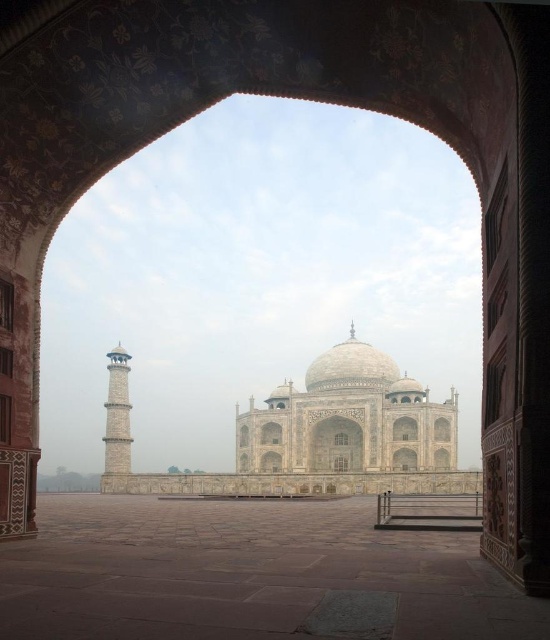
You are standing in the brown stone courtyard at center and want to take a photo of the stone minaret at left. Since the courtyard is lower, will you need to look up or down to frame the minaret properly?

The brown stone courtyard at center has a lesser height compared to stone minaret at left, so you will need to look up to frame the minaret properly.

You are planning to place a large statue in the brown stone courtyard at center. Considering the size of the stone minaret at left, can the statue fit in the courtyard?

The brown stone courtyard at center has a larger width than the stone minaret at left, so the statue can fit in the courtyard as it is wider than the minaret.